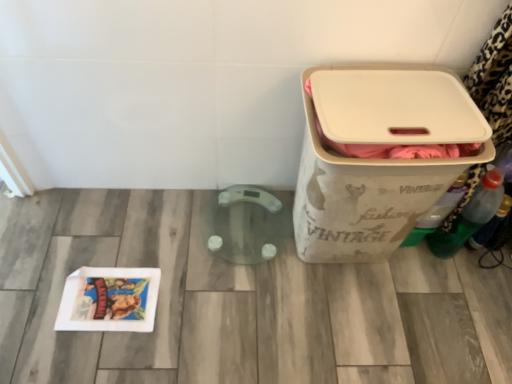
Find the location of a particular element. The image size is (512, 384). free space in front of translucent plastic bottle at right, the first bottle when ordered from right to left is located at coordinates (477, 284).